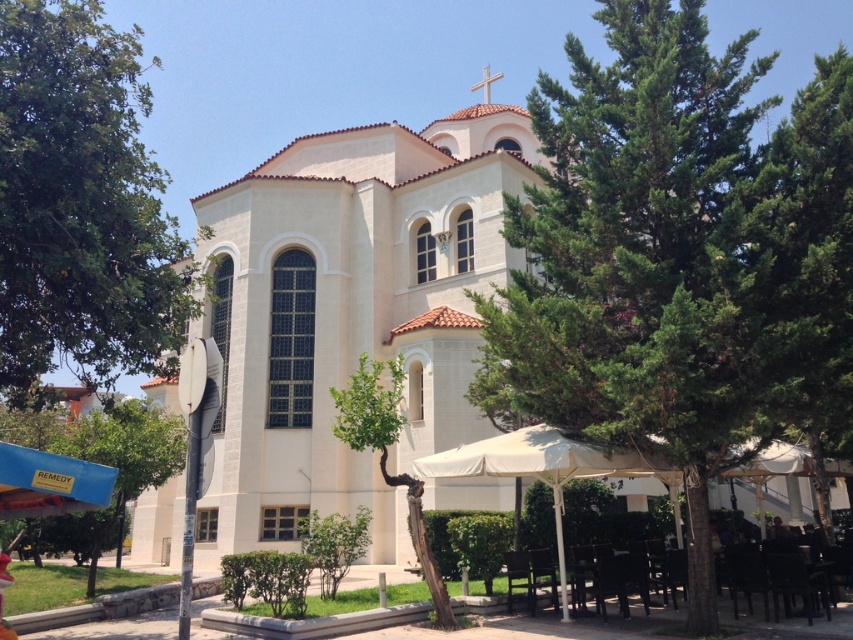
Does green leafy tree at left have a larger size compared to blue fabric canopy at lower left?

Yes, green leafy tree at left is bigger than blue fabric canopy at lower left.

Which of these two, green leafy tree at left or blue fabric canopy at lower left, stands taller?

green leafy tree at left is taller.

Between point (111, 304) and point (9, 509), which one is positioned in front?

Point (9, 509) is more forward.

You are a GUI agent. You are given a task and a screenshot of the screen. Output one action in this format:
    pyautogui.click(x=<x>, y=<y>)
    Task: Click on the green leafy tree at left
    Image resolution: width=853 pixels, height=640 pixels.
    Given the screenshot: What is the action you would take?
    pos(80,204)

Can you confirm if green leafy tree at lower left is thinner than green leafy tree at lower center?

No.

In order to click on green leafy tree at lower left in this screenshot , I will do `click(109, 465)`.

Between point (99, 528) and point (329, 589), which one is positioned behind?

The point (99, 528) is more distant.

Locate an element on the screen. The width and height of the screenshot is (853, 640). green leafy tree at lower left is located at coordinates (109, 465).

Does green leafy tree at left appear over wooden chair at lower center?

Yes, green leafy tree at left is above wooden chair at lower center.

Who is shorter, green leafy tree at left or wooden chair at lower center?

wooden chair at lower center

Find the location of a particular element. Image resolution: width=853 pixels, height=640 pixels. green leafy tree at left is located at coordinates (80, 204).

At what (x,y) coordinates should I click in order to perform the action: click on green leafy tree at left. Please return your answer as a coordinate pair (x, y). The width and height of the screenshot is (853, 640). Looking at the image, I should click on (80, 204).